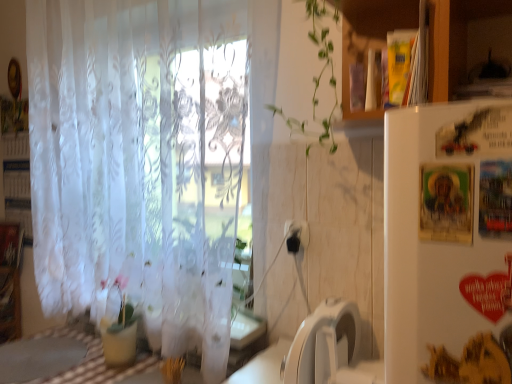
Question: Is point (59, 334) positioned closer to the camera than point (307, 228)?

Choices:
 (A) farther
 (B) closer

Answer: (A)

Question: Considering the positions of checkered fabric table at lower left and black plastic electric outlet at center in the image, is checkered fabric table at lower left wider or thinner than black plastic electric outlet at center?

Choices:
 (A) thin
 (B) wide

Answer: (B)

Question: Which object is the farthest from the black plastic electric outlet at center?

Choices:
 (A) checkered fabric table at lower left
 (B) white cardboard bookshelf at left
 (C) translucent white curtain at left
 (D) white plastic washing machine at lower center

Answer: (B)

Question: Estimate the real-world distances between objects in this image. Which object is closer to the checkered fabric table at lower left?

Choices:
 (A) white cardboard bookshelf at left
 (B) translucent white curtain at left
 (C) black plastic electric outlet at center
 (D) white plastic washing machine at lower center

Answer: (B)